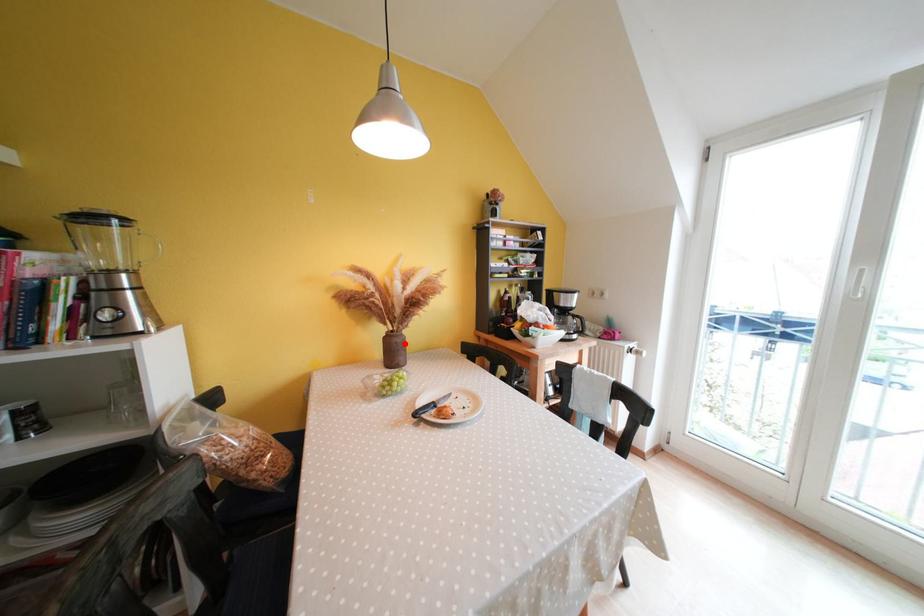
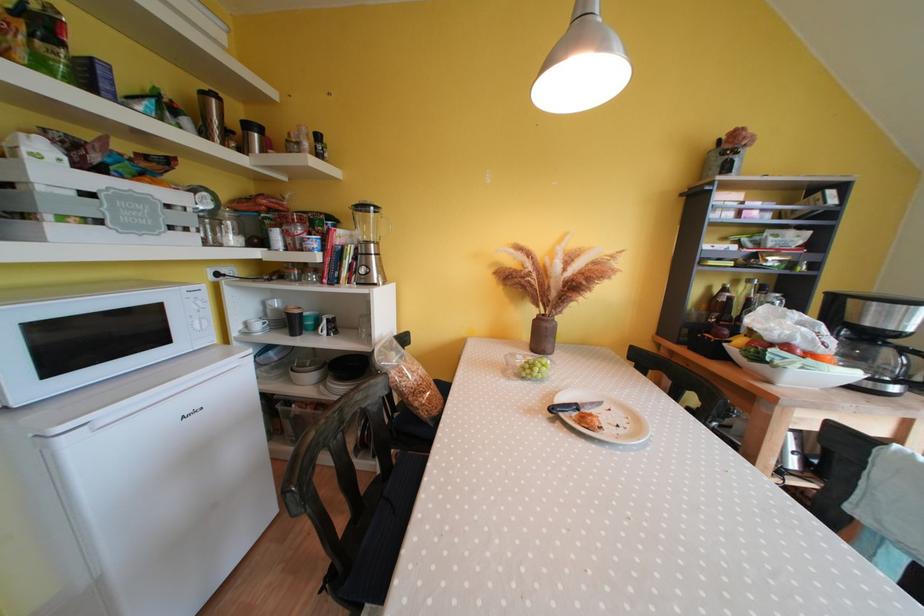
In the second image, find the point that corresponds to the highlighted location in the first image.

(554, 330)